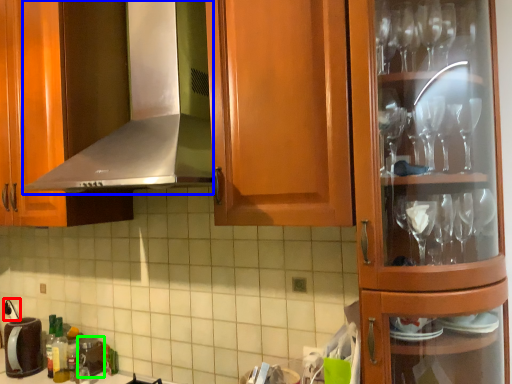
Question: Which object is the farthest from faucet (highlighted by a red box)? Choose among these: exhaust hood (highlighted by a blue box) or appliance (highlighted by a green box).

Choices:
 (A) exhaust hood
 (B) appliance

Answer: (A)